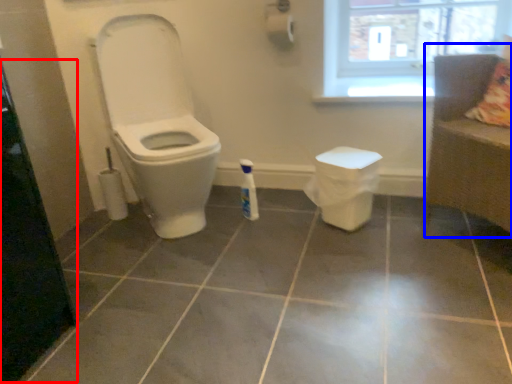
Question: Which object appears closest to the camera in this image, screen door (highlighted by a red box) or couch (highlighted by a blue box)?

Choices:
 (A) screen door
 (B) couch

Answer: (A)